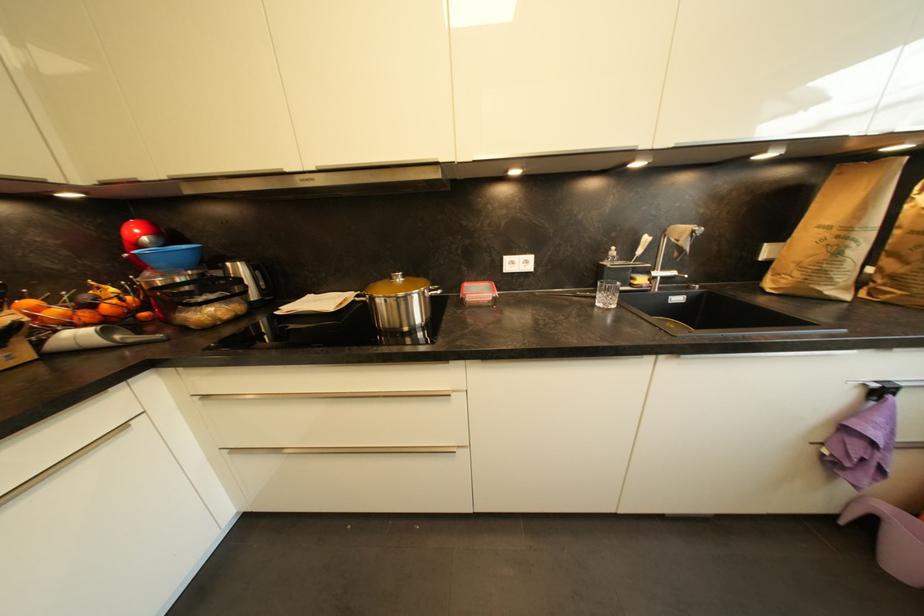
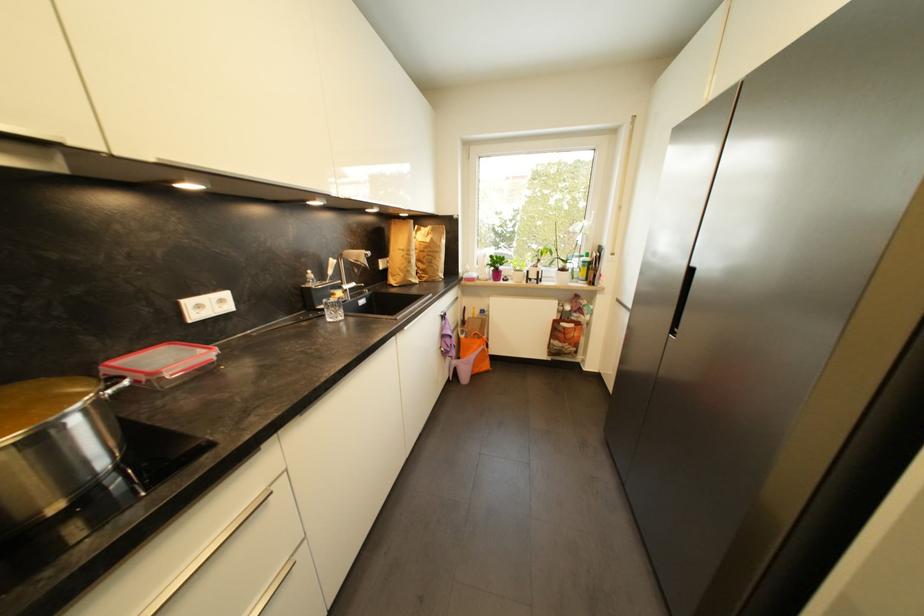
Locate, in the second image, the point that corresponds to pixel 469 297 in the first image.

(162, 375)